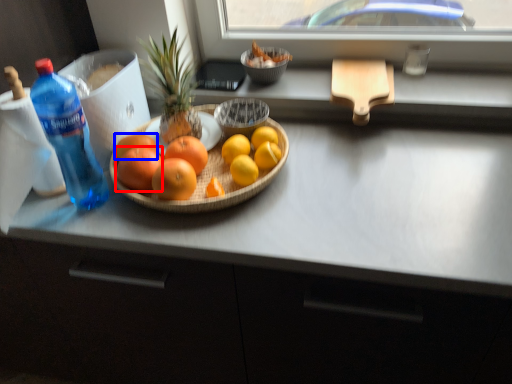
Question: Which of the following is the closest to the observer, grapefruit (highlighted by a red box) or grapefruit (highlighted by a blue box)?

Choices:
 (A) grapefruit
 (B) grapefruit

Answer: (A)